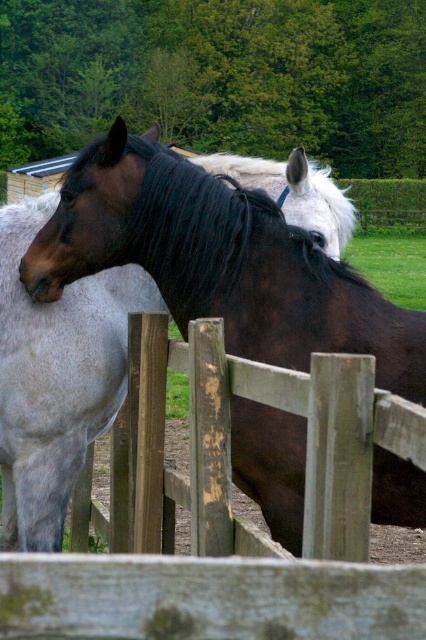
Question: Does weathered wood fence at center have a smaller size compared to shiny brown horse at center?

Choices:
 (A) no
 (B) yes

Answer: (B)

Question: Which of these objects is positioned closest to the shiny brown horse at left?

Choices:
 (A) weathered wood fence at center
 (B) shiny brown horse at center

Answer: (A)

Question: Which object appears closest to the camera in this image?

Choices:
 (A) shiny brown horse at left
 (B) weathered wood fence at center

Answer: (B)

Question: From the image, what is the correct spatial relationship of weathered wood fence at center in relation to shiny brown horse at center?

Choices:
 (A) below
 (B) above

Answer: (B)

Question: Which point is farther from the camera taking this photo?

Choices:
 (A) (100, 593)
 (B) (3, 218)

Answer: (B)

Question: Does weathered wood fence at center have a smaller size compared to shiny brown horse at left?

Choices:
 (A) no
 (B) yes

Answer: (B)